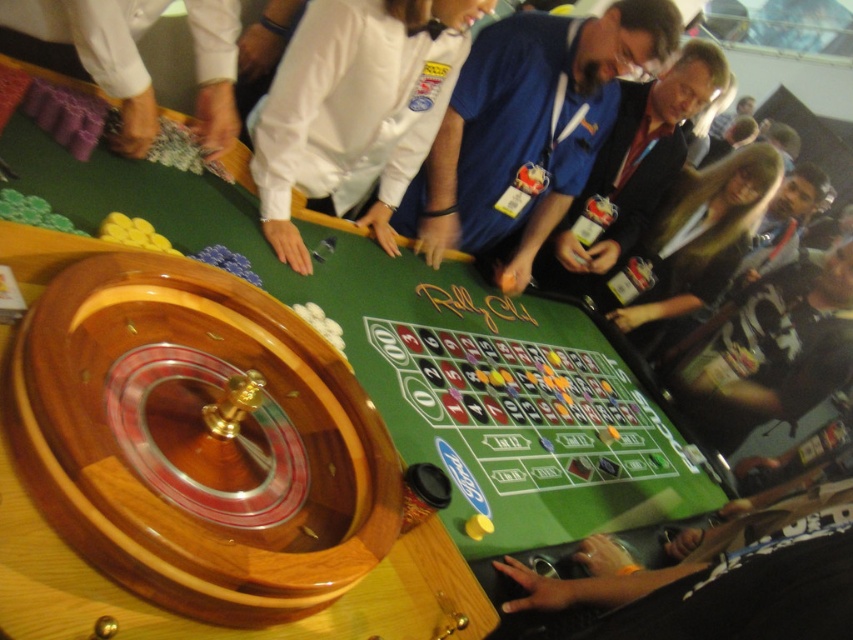
Is blue fabric shirt at center to the right of long brown hair at center from the viewer's perspective?

In fact, blue fabric shirt at center is to the left of long brown hair at center.

What do you see at coordinates (527, 129) in the screenshot? The height and width of the screenshot is (640, 853). I see `blue fabric shirt at center` at bounding box center [527, 129].

Find the location of a particular element. Image resolution: width=853 pixels, height=640 pixels. blue fabric shirt at center is located at coordinates coord(527,129).

Is white shirt at center further to camera compared to long brown hair at center?

No.

This screenshot has width=853, height=640. In order to click on white shirt at center in this screenshot , I will do `click(355, 109)`.

Identify the location of white shirt at center. The width and height of the screenshot is (853, 640). (355, 109).

Is blue fabric shirt at center behind white fabric at upper left?

Yes.

Which is more to the left, blue fabric shirt at center or white fabric at upper left?

white fabric at upper left

Where is `blue fabric shirt at center`? blue fabric shirt at center is located at coordinates (527, 129).

This screenshot has height=640, width=853. What are the coordinates of `blue fabric shirt at center` in the screenshot? It's located at (x=527, y=129).